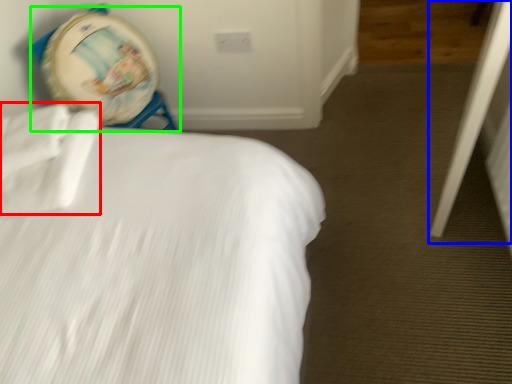
Question: Considering the real-world distances, which object is closest to sheet (highlighted by a red box)? screen door (highlighted by a blue box) or swivel chair (highlighted by a green box).

Choices:
 (A) screen door
 (B) swivel chair

Answer: (B)